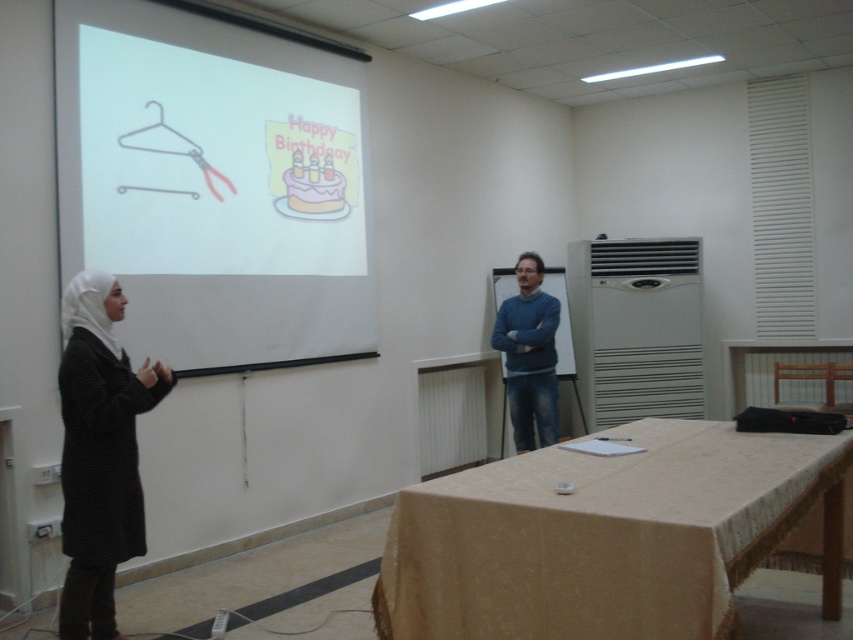
Question: Which object is farther from the camera taking this photo?

Choices:
 (A) black matte hijab at lower left
 (B) metallic hanger at upper left
 (C) blue sweater at center

Answer: (C)

Question: From the image, what is the correct spatial relationship of beige fabric table at lower center in relation to metallic hanger at upper left?

Choices:
 (A) below
 (B) above

Answer: (A)

Question: Which point is closer to the camera?

Choices:
 (A) white matte projection screen at upper left
 (B) blue sweater at center
 (C) beige fabric table at lower center

Answer: (C)

Question: Which point is closer to the camera?

Choices:
 (A) (805, 474)
 (B) (184, 300)
 (C) (70, 342)

Answer: (A)

Question: Is black matte hijab at lower left above blue sweater at center?

Choices:
 (A) no
 (B) yes

Answer: (A)

Question: Is beige fabric table at lower center closer to the viewer compared to metallic hanger at upper left?

Choices:
 (A) no
 (B) yes

Answer: (B)